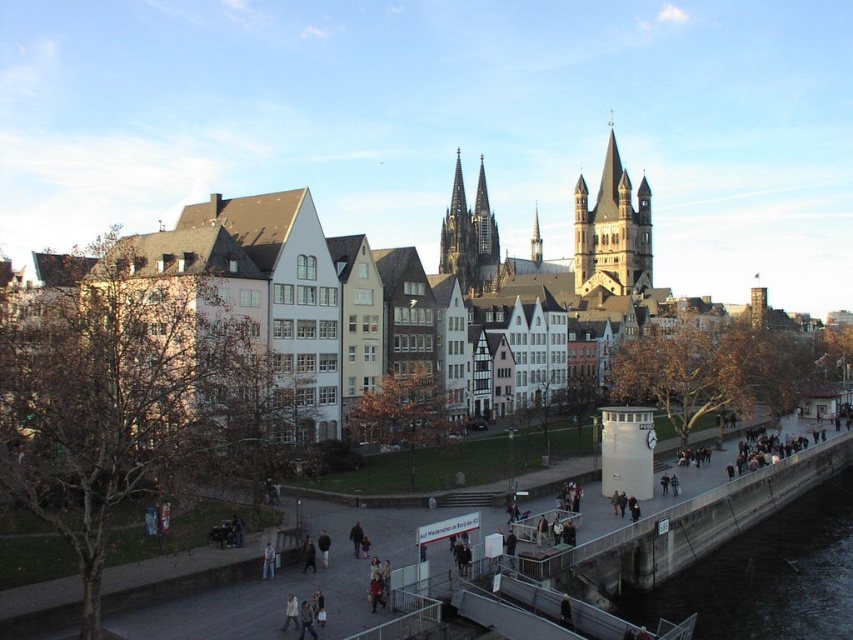
Question: Does white stone buildings at center appear under dark gray concrete river at lower right?

Choices:
 (A) yes
 (B) no

Answer: (B)

Question: Considering the real-world distances, which object is farthest from the light brown leather jacket at lower center?

Choices:
 (A) dark gray concrete river at lower right
 (B) dark gray stone tower at center
 (C) golden stone tower at center

Answer: (B)

Question: Which object is closer to the camera taking this photo?

Choices:
 (A) dark gray stone tower at center
 (B) golden stone tower at center

Answer: (B)

Question: From the image, what is the correct spatial relationship of dark gray concrete river at lower right in relation to light brown leather jacket at lower center?

Choices:
 (A) above
 (B) below

Answer: (B)

Question: Which point is farther from the camera taking this photo?

Choices:
 (A) (624, 172)
 (B) (274, 561)

Answer: (A)

Question: Does golden stone tower at center appear on the right side of dark gray stone tower at center?

Choices:
 (A) yes
 (B) no

Answer: (A)